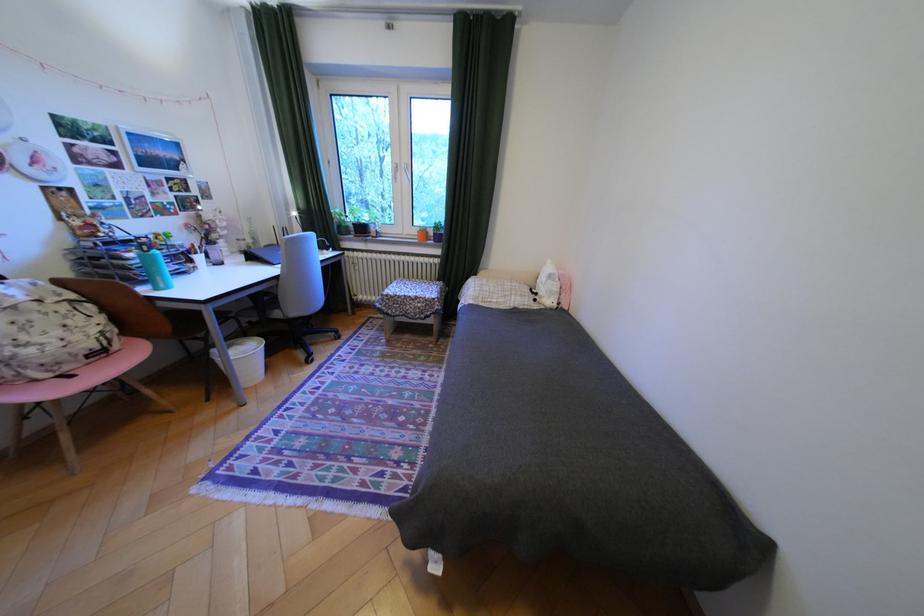
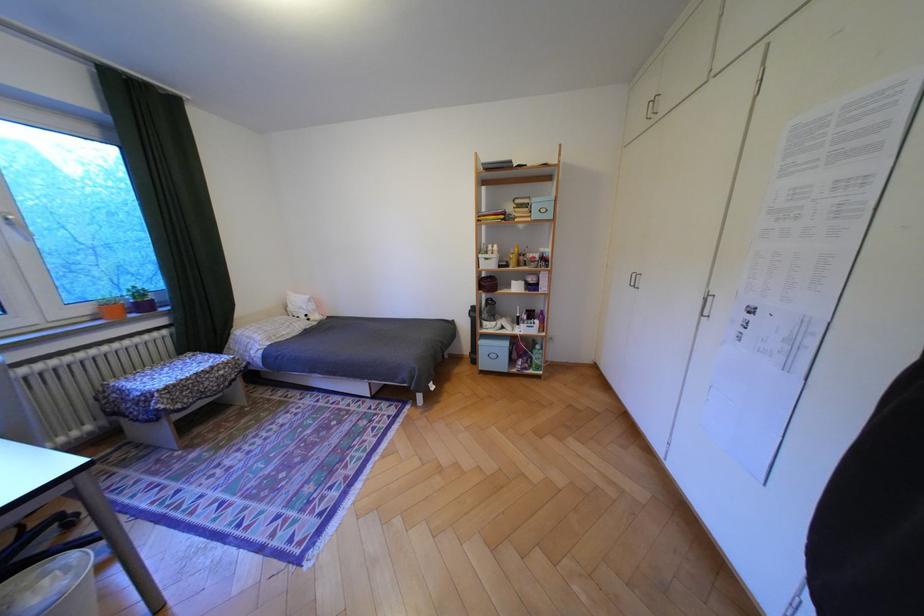
The point at [427,232] is marked in the first image. Where is the corresponding point in the second image?

(99, 310)